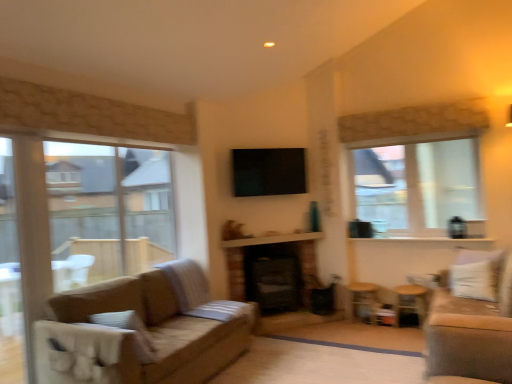
Question: From a real-world perspective, is clear glass window at left, which appears as the first window when viewed from the left, on top of black brick fireplace at center?

Choices:
 (A) yes
 (B) no

Answer: (A)

Question: Is clear glass window at left, acting as the second window starting from the back, located outside black brick fireplace at center?

Choices:
 (A) yes
 (B) no

Answer: (A)

Question: Is clear glass window at left, which appears as the first window when viewed from the left, in front of black brick fireplace at center?

Choices:
 (A) yes
 (B) no

Answer: (A)

Question: From the image's perspective, is clear glass window at left, which appears as the first window when viewed from the left, on black brick fireplace at center?

Choices:
 (A) no
 (B) yes

Answer: (B)

Question: Is the depth of clear glass window at left, which is counted as the second window, starting from the right, greater than that of black brick fireplace at center?

Choices:
 (A) no
 (B) yes

Answer: (A)

Question: From the image's perspective, is velvet beige couch at right positioned above or below wooden side table at lower right, the 1th side table from the left?

Choices:
 (A) below
 (B) above

Answer: (B)

Question: In the image, is velvet beige couch at right positioned in front of or behind wooden side table at lower right, the 1th side table from the left?

Choices:
 (A) behind
 (B) front

Answer: (B)

Question: From a real-world perspective, is velvet beige couch at right above or below wooden side table at lower right, the 1th side table from the left?

Choices:
 (A) below
 (B) above

Answer: (B)

Question: Looking at their shapes, would you say velvet beige couch at right is wider or thinner than wooden side table at lower right, which is the second side table in right-to-left order?

Choices:
 (A) wide
 (B) thin

Answer: (A)

Question: From the image's perspective, relative to clear glass window at left, which appears as the first window when viewed from the left, is velvet beige couch at right above or below?

Choices:
 (A) below
 (B) above

Answer: (A)

Question: Does point (495, 357) appear closer or farther from the camera than point (64, 254)?

Choices:
 (A) closer
 (B) farther

Answer: (A)

Question: In terms of size, does velvet beige couch at right appear bigger or smaller than clear glass window at left, acting as the second window starting from the back?

Choices:
 (A) small
 (B) big

Answer: (B)

Question: From a real-world perspective, relative to clear glass window at left, which appears as the first window when viewed from the left, is velvet beige couch at right vertically above or below?

Choices:
 (A) above
 (B) below

Answer: (B)

Question: From the image's perspective, is white textured balcony at center located above or below wooden side table at lower right, the 2th side table viewed from the left?

Choices:
 (A) below
 (B) above

Answer: (B)

Question: Is point (293, 236) positioned closer to the camera than point (401, 291)?

Choices:
 (A) farther
 (B) closer

Answer: (A)